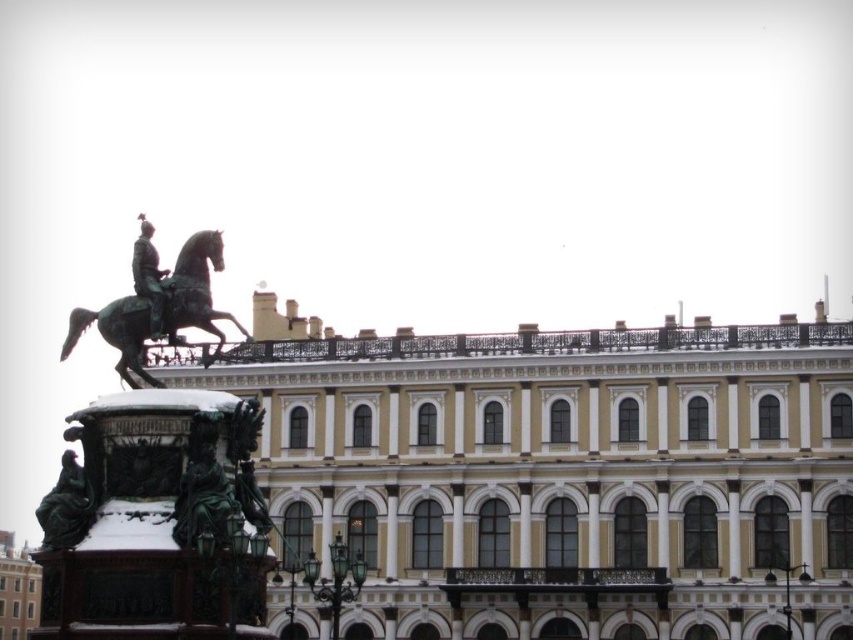
Who is lower down, bronze/golden horse at left or green patina statue at lower left?

green patina statue at lower left is lower down.

Who is shorter, bronze/golden horse at left or green patina statue at lower left?

bronze/golden horse at left

Is point (212, 252) closer to camera compared to point (86, 518)?

No, it is behind (86, 518).

Where is `bronze/golden horse at left`? The width and height of the screenshot is (853, 640). bronze/golden horse at left is located at coordinates (194, 289).

Does golden stone palace at center have a greater height compared to green patina statue at lower left?

Yes, golden stone palace at center is taller than green patina statue at lower left.

Is golden stone palace at center below green patina statue at lower left?

Incorrect, golden stone palace at center is not positioned below green patina statue at lower left.

Describe the element at coordinates (558, 472) in the screenshot. I see `golden stone palace at center` at that location.

You are a GUI agent. You are given a task and a screenshot of the screen. Output one action in this format:
    pyautogui.click(x=<x>, y=<y>)
    Task: Click on the golden stone palace at center
    The image size is (853, 640).
    Given the screenshot: What is the action you would take?
    pyautogui.click(x=558, y=472)

Is point (74, 522) positioned in front of point (160, 333)?

Yes, it is.

Can you confirm if green patina statue at lower left is bigger than green patina statue at upper center?

Indeed, green patina statue at lower left has a larger size compared to green patina statue at upper center.

Identify the location of green patina statue at lower left. (67, 506).

Locate an element on the screen. Image resolution: width=853 pixels, height=640 pixels. green patina statue at lower left is located at coordinates (67, 506).